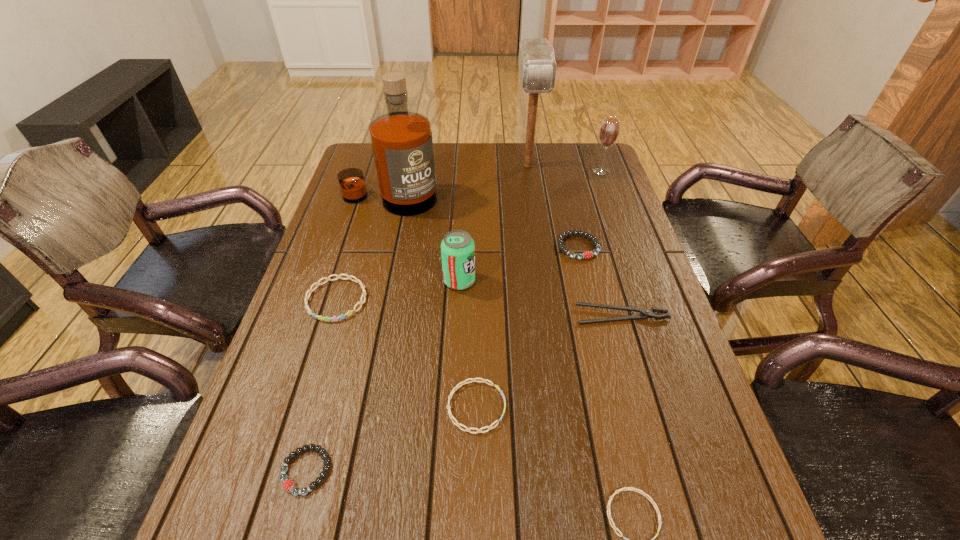
The height and width of the screenshot is (540, 960). What are the coordinates of `vacant space that is in between the second nearest blue bracelet and the pop soda` in the screenshot? It's located at (468, 344).

Where is `unoccupied area between the pop soda and the red wineglass`? The height and width of the screenshot is (540, 960). unoccupied area between the pop soda and the red wineglass is located at coordinates (530, 226).

Point out which object is positioned as the ninth nearest to the left black bracelet. Please provide its 2D coordinates. Your answer should be formatted as a tuple, i.e. [(x, y)], where the tuple contains the x and y coordinates of a point satisfying the conditions above.

[(609, 130)]

Where is `object that is the third closest to the rightmost blue bracelet`? object that is the third closest to the rightmost blue bracelet is located at coordinates tap(288, 485).

Locate an element on the screen. This screenshot has width=960, height=540. the fourth closest bracelet to the second farthest blue bracelet is located at coordinates (587, 254).

The width and height of the screenshot is (960, 540). In order to click on bracelet that is the fourth closest one to the fifth object from right to left in this screenshot , I will do `click(625, 488)`.

Locate which blue bracelet is the third closest to the liquor. Please provide its 2D coordinates. Your answer should be formatted as a tuple, i.e. [(x, y)], where the tuple contains the x and y coordinates of a point satisfying the conditions above.

[(625, 488)]

Select which blue bracelet appears as the second closest to the tongs. Please provide its 2D coordinates. Your answer should be formatted as a tuple, i.e. [(x, y)], where the tuple contains the x and y coordinates of a point satisfying the conditions above.

[(625, 488)]

Image resolution: width=960 pixels, height=540 pixels. Identify the location of free region that satisfies the following two spatial constraints: 1. on the front-facing side of the pop soda; 2. on the back side of the tongs. (458, 315).

Image resolution: width=960 pixels, height=540 pixels. Find the location of `free space that satisfies the following two spatial constraints: 1. on the striking face of the third tallest object; 2. on the left side of the sixth object from left to right`. free space that satisfies the following two spatial constraints: 1. on the striking face of the third tallest object; 2. on the left side of the sixth object from left to right is located at coordinates (529, 171).